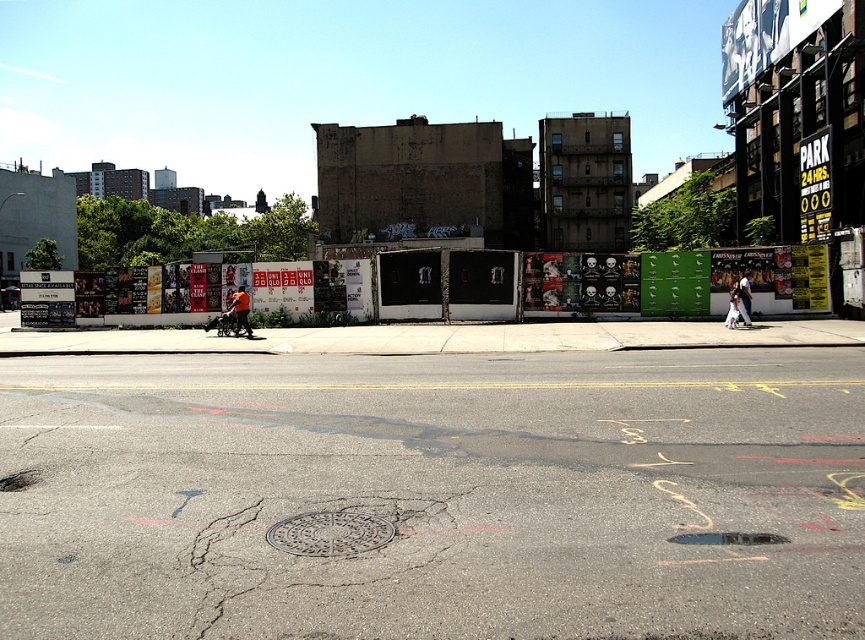
Question: Which of the following is the closest to the observer?

Choices:
 (A) (742, 275)
 (B) (414, 545)

Answer: (B)

Question: Does orange fabric stroller at center appear under white cotton shirt at center?

Choices:
 (A) yes
 (B) no

Answer: (A)

Question: Which point is closer to the camera taking this photo?

Choices:
 (A) (745, 284)
 (B) (279, 624)

Answer: (B)

Question: Is the position of orange fabric stroller at center more distant than that of white cotton shirt at center?

Choices:
 (A) no
 (B) yes

Answer: (B)

Question: Is orange fabric stroller at center to the right of white cotton shirt at center from the viewer's perspective?

Choices:
 (A) no
 (B) yes

Answer: (A)

Question: Among these points, which one is farthest from the camera?

Choices:
 (A) (742, 301)
 (B) (385, 632)
 (C) (236, 294)

Answer: (C)